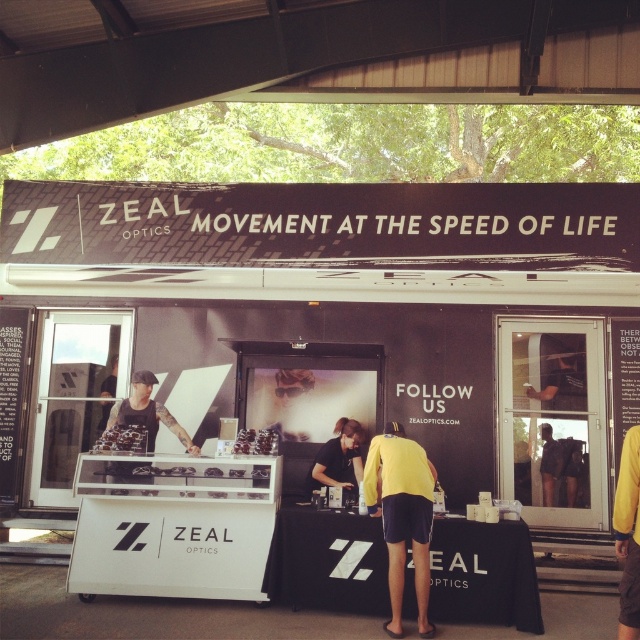
You are a photographer at the Zeal Optics booth. You need to capture a photo where both the black matte shirt at center and the matte black sunglasses at center are clearly visible. Given their sizes, which object should you focus on first to ensure proper framing?

The black matte shirt at center has a larger size compared to the matte black sunglasses at center, so you should focus on the black matte shirt at center first to ensure proper framing.

You are a photographer at the Zeal Optics booth and want to capture a clear photo of both the yellow matte shirt at center and the matte black sunglasses at center. Since the camera can only focus on one object at a time, which object should you focus on to ensure the larger one is in focus?

The yellow matte shirt at center is bigger than the matte black sunglasses at center, so you should focus on the yellow matte shirt at center to ensure the larger object is in focus.